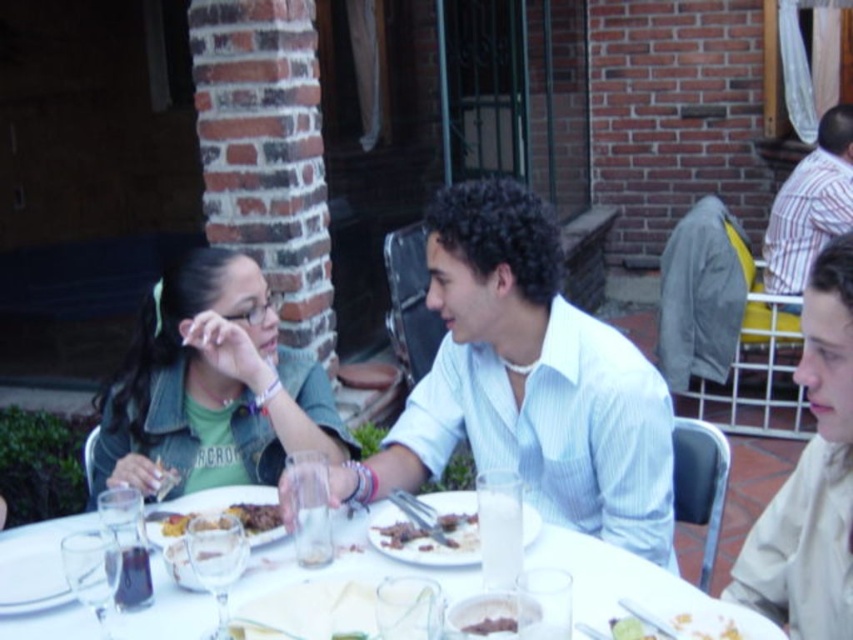
Between yellowish matte plate at lower right and brown crumbly bread at center, which one has less height?

With less height is brown crumbly bread at center.

Looking at this image, is yellowish matte plate at lower right below brown crumbly bread at center?

Indeed, yellowish matte plate at lower right is positioned under brown crumbly bread at center.

Find the location of a particular element. yellowish matte plate at lower right is located at coordinates (704, 627).

Which is more to the left, white striped shirt at center or denim jacket at upper left?

From the viewer's perspective, denim jacket at upper left appears more on the left side.

Image resolution: width=853 pixels, height=640 pixels. What do you see at coordinates (527, 381) in the screenshot?
I see `white striped shirt at center` at bounding box center [527, 381].

Who is more distant from viewer, (653, 538) or (206, 429)?

Positioned behind is point (206, 429).

The height and width of the screenshot is (640, 853). What are the coordinates of `white striped shirt at center` in the screenshot? It's located at (527, 381).

Which of these two, white glossy table at center or yellowish matte plate at lower right, stands shorter?

yellowish matte plate at lower right

Is point (628, 593) closer to viewer compared to point (689, 625)?

No, (628, 593) is behind (689, 625).

This screenshot has width=853, height=640. Find the location of `white glossy table at center`. white glossy table at center is located at coordinates (627, 582).